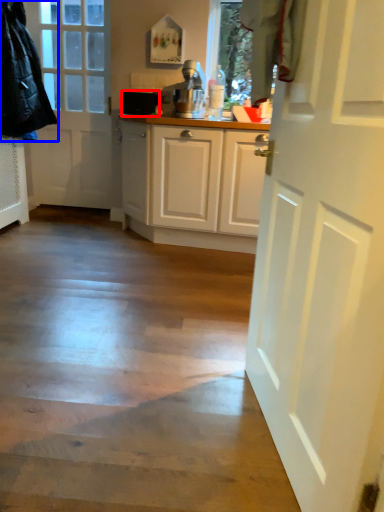
Question: Which object appears farthest to the camera in this image, appliance (highlighted by a red box) or jacket (highlighted by a blue box)?

Choices:
 (A) appliance
 (B) jacket

Answer: (A)